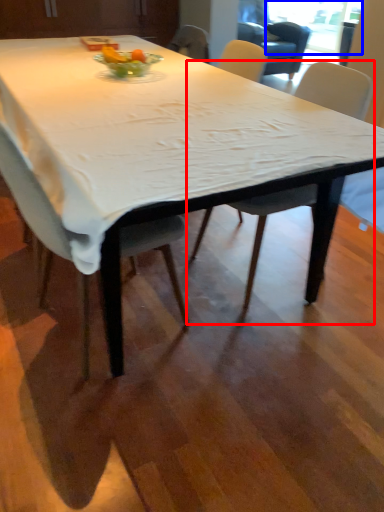
Question: Which object appears farthest to the camera in this image, chair (highlighted by a red box) or window screen (highlighted by a blue box)?

Choices:
 (A) chair
 (B) window screen

Answer: (B)